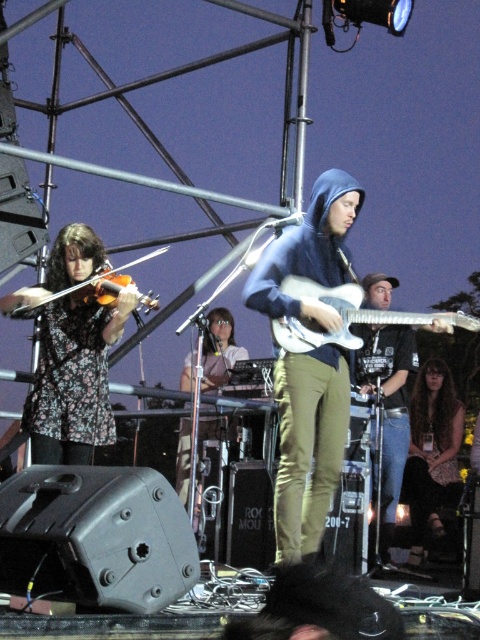
Question: Considering the real-world distances, which object is closest to the brown hair at center?

Choices:
 (A) wooden violin at left
 (B) white glossy electric guitar at center

Answer: (B)

Question: Considering the relative positions of brown hair at center and wooden violin at left in the image provided, where is brown hair at center located with respect to wooden violin at left?

Choices:
 (A) right
 (B) left

Answer: (A)

Question: Which object appears farthest from the camera in this image?

Choices:
 (A) wooden violin at left
 (B) brown hair at center

Answer: (B)

Question: Which point is farther from the camera taking this photo?

Choices:
 (A) (327, 296)
 (B) (421, 468)

Answer: (B)

Question: Does brown hair at center have a larger size compared to wooden violin at left?

Choices:
 (A) no
 (B) yes

Answer: (B)

Question: Does brown hair at center appear on the left side of white glossy electric guitar at center?

Choices:
 (A) yes
 (B) no

Answer: (B)